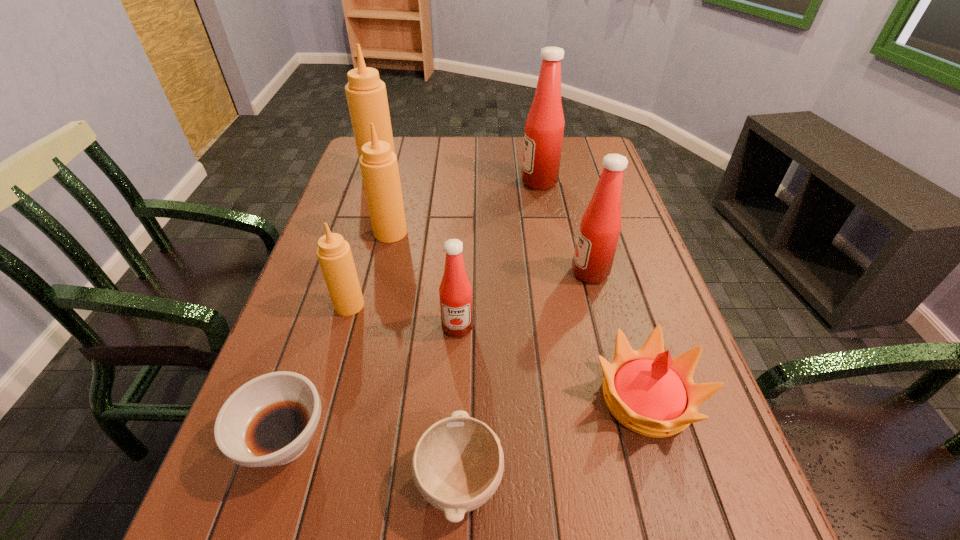
I want to click on vacant region located 0.320m on the front-facing side of the fourth farthest object, so click(437, 273).

Identify the location of vacant area situated on the front of the nearest tan condiment. The width and height of the screenshot is (960, 540). (318, 414).

Identify the location of vacant space situated 0.310m on the front-facing side of the nearest red condiment. This screenshot has width=960, height=540. (449, 498).

Image resolution: width=960 pixels, height=540 pixels. Identify the location of vacant region located 0.130m on the back of the yellow crown. (618, 306).

You are a GUI agent. You are given a task and a screenshot of the screen. Output one action in this format:
    pyautogui.click(x=<x>, y=<y>)
    Task: Click on the blank area located 0.100m on the back of the soup bowl
    The image size is (960, 540).
    Given the screenshot: What is the action you would take?
    pyautogui.click(x=313, y=355)

Where is `free space located on the right of the beige bowl`? free space located on the right of the beige bowl is located at coordinates (596, 479).

In order to click on object that is positioned at the near edge in this screenshot , I will do `click(458, 463)`.

The width and height of the screenshot is (960, 540). Identify the location of soup bowl that is at the left edge. (269, 421).

Where is `condiment present at the right edge`? This screenshot has height=540, width=960. condiment present at the right edge is located at coordinates (600, 227).

At what (x,y) coordinates should I click in order to perform the action: click on crown present at the right edge. Please return your answer as a coordinate pair (x, y). Looking at the image, I should click on (650, 393).